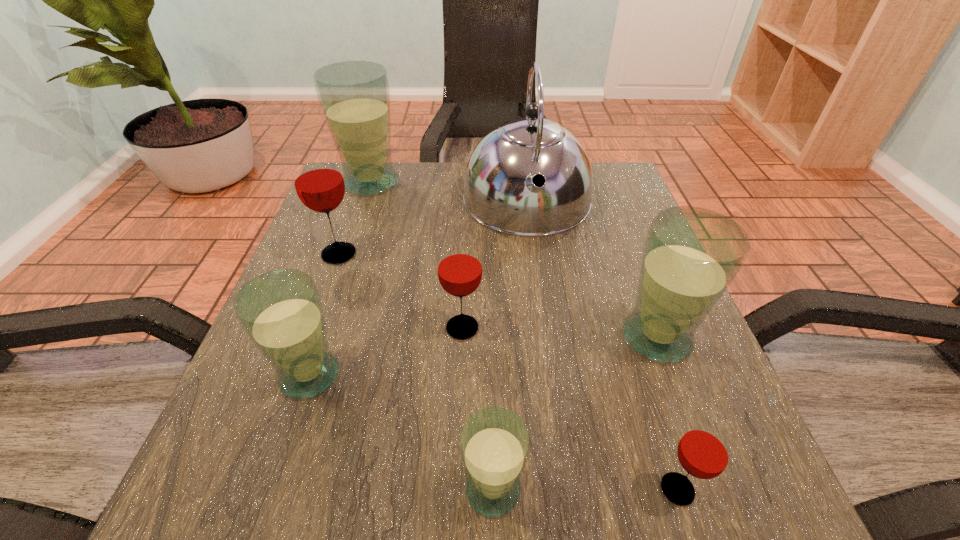
Locate an element on the screen. The width and height of the screenshot is (960, 540). empty location between the kettle and the second nearest red glass is located at coordinates (494, 265).

Identify the location of free space that is in between the third smallest blue glass and the kettle. coord(592,270).

Image resolution: width=960 pixels, height=540 pixels. I want to click on object that is the fifth closest to the third biggest blue glass, so click(354, 96).

Identify which object is the fifth nearest to the third biggest blue glass. Please provide its 2D coordinates. Your answer should be formatted as a tuple, i.e. [(x, y)], where the tuple contains the x and y coordinates of a point satisfying the conditions above.

[(354, 96)]

Identify the location of the fifth closest glass to the farthest glass. (494, 442).

Where is `glass that is the fourth nearest to the second red glass from right to left`? Image resolution: width=960 pixels, height=540 pixels. glass that is the fourth nearest to the second red glass from right to left is located at coordinates (691, 255).

Select which blue glass is the third closest to the biggest blue glass. Please provide its 2D coordinates. Your answer should be formatted as a tuple, i.e. [(x, y)], where the tuple contains the x and y coordinates of a point satisfying the conditions above.

[(494, 442)]

Image resolution: width=960 pixels, height=540 pixels. Find the location of `blue glass that is the third closest to the kettle`. blue glass that is the third closest to the kettle is located at coordinates (281, 312).

I want to click on red glass that is the closest to the second smallest red glass, so click(x=319, y=184).

Locate which red glass is the closest to the smallest red glass. Please provide its 2D coordinates. Your answer should be formatted as a tuple, i.e. [(x, y)], where the tuple contains the x and y coordinates of a point satisfying the conditions above.

[(459, 267)]